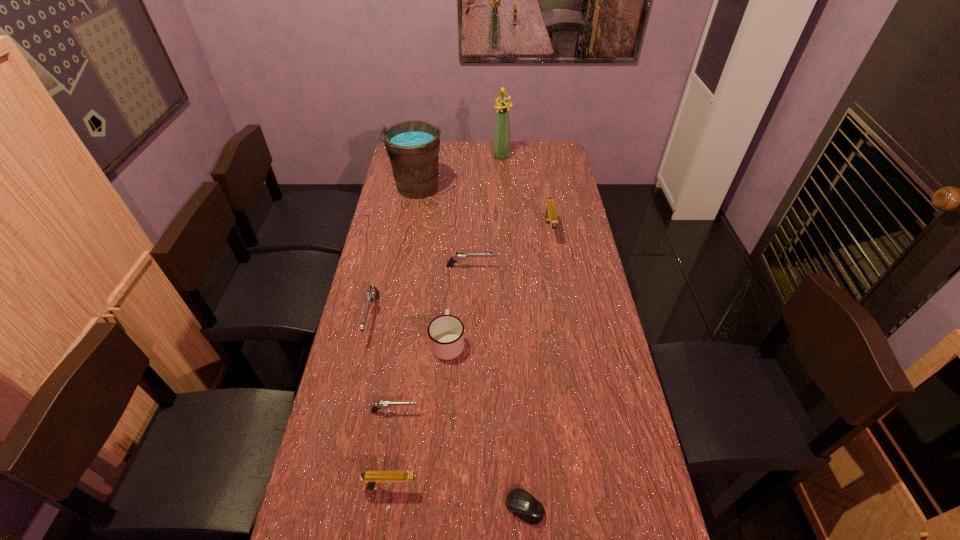
Locate an element on the screen. blank area in the image that satisfies the following two spatial constraints: 1. on the front-facing side of the mouse; 2. on the right side of the second farthest pistol is located at coordinates (466, 508).

Identify the location of vacant space that satisfies the following two spatial constraints: 1. on the front-facing side of the rightmost silver pistol; 2. on the left side of the mouse. The height and width of the screenshot is (540, 960). (466, 508).

Locate an element on the screen. Image resolution: width=960 pixels, height=540 pixels. free location that satisfies the following two spatial constraints: 1. on the front-facing side of the rightmost silver pistol; 2. on the right side of the shortest object is located at coordinates (466, 508).

This screenshot has height=540, width=960. Find the location of `vacant space that satisfies the following two spatial constraints: 1. on the front-facing side of the second smallest silver pistol; 2. on the front-facing side of the biggest silver pistol`. vacant space that satisfies the following two spatial constraints: 1. on the front-facing side of the second smallest silver pistol; 2. on the front-facing side of the biggest silver pistol is located at coordinates (469, 318).

Identify the location of vacant space that satisfies the following two spatial constraints: 1. on the front-facing side of the shortest object; 2. on the left side of the second nearest pistol. (381, 508).